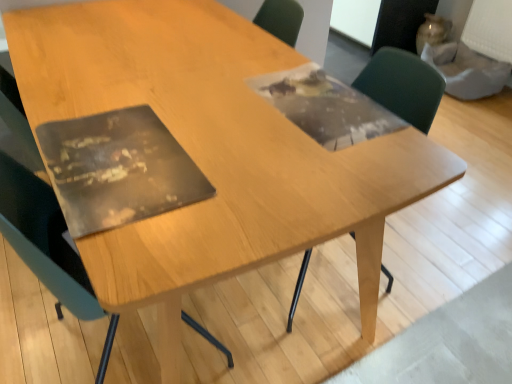
Question: Considering the positions of matte black chair at left, the first chair when ordered from left to right, and green plastic chair at upper right, the 1th chair viewed from the right, in the image, is matte black chair at left, the first chair when ordered from left to right, taller or shorter than green plastic chair at upper right, the 1th chair viewed from the right,?

Choices:
 (A) short
 (B) tall

Answer: (B)

Question: From a real-world perspective, relative to green plastic chair at upper right, which is the 2th chair from left to right, is matte black chair at left, arranged as the 2th chair when viewed from the right, vertically above or below?

Choices:
 (A) below
 (B) above

Answer: (A)

Question: Is point (26, 213) positioned closer to the camera than point (407, 62)?

Choices:
 (A) farther
 (B) closer

Answer: (B)

Question: Is point (415, 119) closer or farther from the camera than point (37, 198)?

Choices:
 (A) closer
 (B) farther

Answer: (B)

Question: From the image's perspective, relative to matte black chair at left, arranged as the 2th chair when viewed from the right, is green plastic chair at upper right, the 1th chair viewed from the right, above or below?

Choices:
 (A) below
 (B) above

Answer: (B)

Question: Is green plastic chair at upper right, which is the 2th chair from left to right, bigger or smaller than matte black chair at left, the first chair when ordered from left to right?

Choices:
 (A) small
 (B) big

Answer: (A)

Question: Relative to matte black chair at left, the first chair when ordered from left to right, is green plastic chair at upper right, which is the 2th chair from left to right, in front or behind?

Choices:
 (A) front
 (B) behind

Answer: (B)